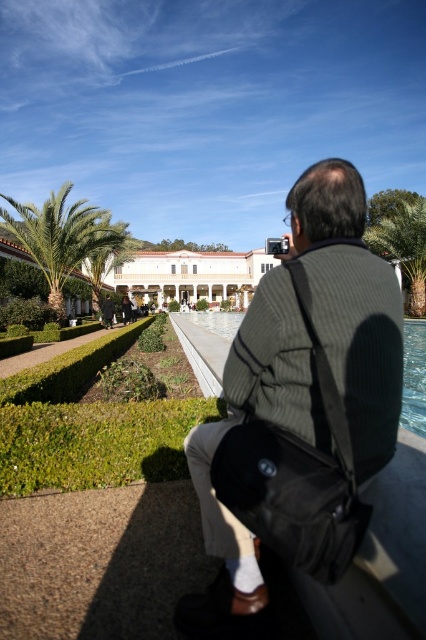
Question: Which of these objects is positioned closest to the green leafy palm tree at upper right?

Choices:
 (A) clear glass pool at center
 (B) green leafy palm tree at left

Answer: (A)

Question: Considering the relative positions of dark gray knitted sweater at center and clear glass pool at center in the image provided, where is dark gray knitted sweater at center located with respect to clear glass pool at center?

Choices:
 (A) right
 (B) left

Answer: (B)

Question: Does green leafy palm tree at left have a smaller size compared to green leafy palm tree at upper right?

Choices:
 (A) no
 (B) yes

Answer: (B)

Question: Is green leafy palm tree at left below clear glass pool at center?

Choices:
 (A) no
 (B) yes

Answer: (A)

Question: Estimate the real-world distances between objects in this image. Which object is closer to the clear glass pool at center?

Choices:
 (A) green leafy palm tree at left
 (B) dark gray knitted sweater at center

Answer: (A)

Question: Which point is closer to the camera?

Choices:
 (A) green leafy palm tree at left
 (B) green leafy palm tree at upper right
 (C) dark gray knitted sweater at center

Answer: (C)